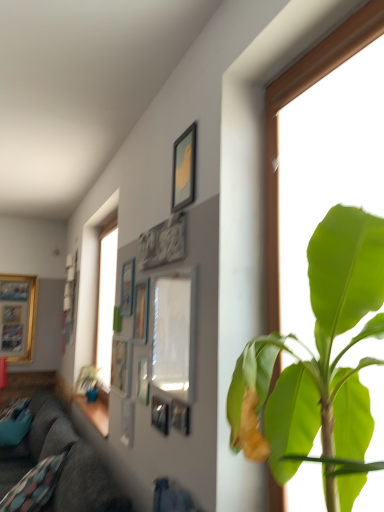
Question: From a real-world perspective, is matte silver picture frame at center, the 6th picture frame positioned from the right, physically above gold-framed picture at left, which is the 1th picture frame from back to front?

Choices:
 (A) no
 (B) yes

Answer: (A)

Question: Does matte silver picture frame at center, the 7th picture frame from the back, appear on the right side of gold-framed picture at left, which is the 1th picture frame from back to front?

Choices:
 (A) no
 (B) yes

Answer: (B)

Question: Is the depth of matte silver picture frame at center, acting as the seventh picture frame starting from the left, less than that of gold-framed picture at left, which is the 1th picture frame from back to front?

Choices:
 (A) no
 (B) yes

Answer: (B)

Question: Does matte silver picture frame at center, the 6th picture frame positioned from the right, have a lesser width compared to gold-framed picture at left, the first picture frame viewed from the left?

Choices:
 (A) yes
 (B) no

Answer: (A)

Question: Is matte silver picture frame at center, the sixth picture frame positioned from the front, not close to gold-framed picture at left, which is the 1th picture frame from back to front?

Choices:
 (A) no
 (B) yes

Answer: (B)

Question: From a real-world perspective, is matte silver picture frame at center, acting as the seventh picture frame starting from the left, physically below gold-framed picture at left, which is the 1th picture frame from back to front?

Choices:
 (A) yes
 (B) no

Answer: (A)

Question: Is the position of dark gray fabric couch at lower left less distant than that of wooden picture frame at upper center, which ranks as the 7th picture frame in front-to-back order?

Choices:
 (A) yes
 (B) no

Answer: (B)

Question: From the image's perspective, is dark gray fabric couch at lower left over wooden picture frame at upper center, the 7th picture frame viewed from the right?

Choices:
 (A) yes
 (B) no

Answer: (B)

Question: Does dark gray fabric couch at lower left have a smaller size compared to wooden picture frame at upper center, the 6th picture frame from the back?

Choices:
 (A) no
 (B) yes

Answer: (A)

Question: Considering the relative positions of dark gray fabric couch at lower left and wooden picture frame at upper center, which ranks as the 7th picture frame in front-to-back order, in the image provided, is dark gray fabric couch at lower left to the right of wooden picture frame at upper center, which ranks as the 7th picture frame in front-to-back order, from the viewer's perspective?

Choices:
 (A) no
 (B) yes

Answer: (A)

Question: Is dark gray fabric couch at lower left oriented towards wooden picture frame at upper center, which ranks as the 7th picture frame in front-to-back order?

Choices:
 (A) no
 (B) yes

Answer: (A)

Question: From the image's perspective, is dark gray fabric couch at lower left located beneath wooden picture frame at upper center, the 6th picture frame from the back?

Choices:
 (A) no
 (B) yes

Answer: (B)

Question: Considering the relative sizes of matte silver picture frame at center, the 7th picture frame from the back, and matte silver picture frame at center, the ninth picture frame in the front-to-back sequence, in the image provided, is matte silver picture frame at center, the 7th picture frame from the back, bigger than matte silver picture frame at center, the ninth picture frame in the front-to-back sequence,?

Choices:
 (A) no
 (B) yes

Answer: (A)